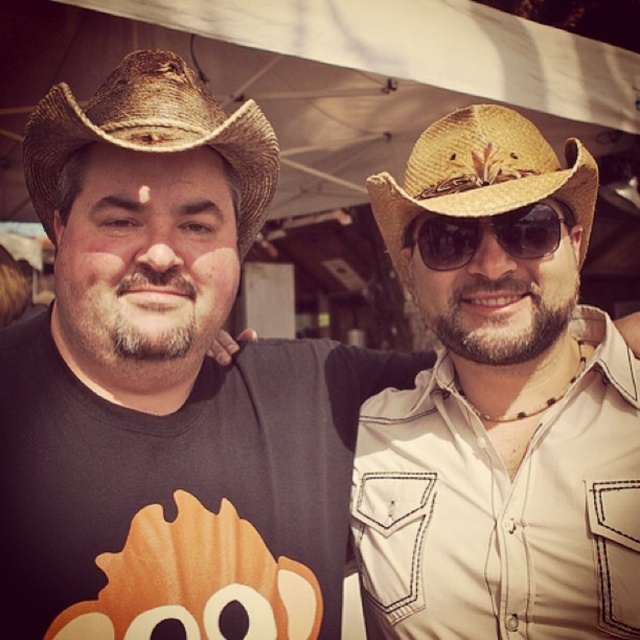
How much distance is there between natural straw cowboy hat at center and sunglasses at center?

A distance of 2.18 inches exists between natural straw cowboy hat at center and sunglasses at center.

Is natural straw cowboy hat at center shorter than sunglasses at center?

No, natural straw cowboy hat at center is not shorter than sunglasses at center.

Who is more forward, [406,205] or [525,225]?

Point [525,225]

Find the location of a particular element. natural straw cowboy hat at center is located at coordinates (481, 176).

Is brown straw cowboy hat at left positioned before sunglasses at center?

That is True.

In the scene shown: Measure the distance between brown straw cowboy hat at left and camera.

The distance of brown straw cowboy hat at left from camera is 29.83 inches.

Image resolution: width=640 pixels, height=640 pixels. What do you see at coordinates (150, 132) in the screenshot? I see `brown straw cowboy hat at left` at bounding box center [150, 132].

What are the coordinates of `brown straw cowboy hat at left` in the screenshot? It's located at (150, 132).

Between brown straw cowboy hat at left and natural straw cowboy hat at center, which one has less height?

With less height is brown straw cowboy hat at left.

Who is taller, brown straw cowboy hat at left or natural straw cowboy hat at center?

Standing taller between the two is natural straw cowboy hat at center.

Find the location of `brown straw cowboy hat at left`. brown straw cowboy hat at left is located at coordinates (150, 132).

Locate an element on the screen. Image resolution: width=640 pixels, height=640 pixels. brown straw cowboy hat at left is located at coordinates coord(150,132).